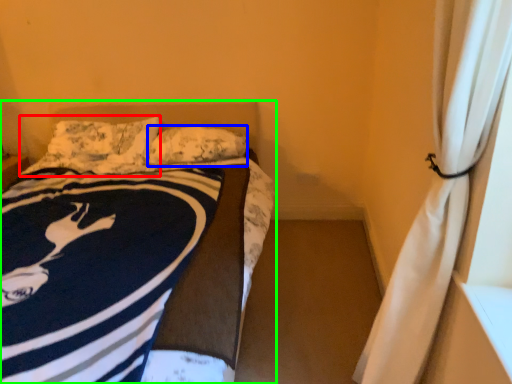
Question: Which is farther away from pillow (highlighted by a red box)? pillow (highlighted by a blue box) or bed (highlighted by a green box)?

Choices:
 (A) pillow
 (B) bed

Answer: (B)